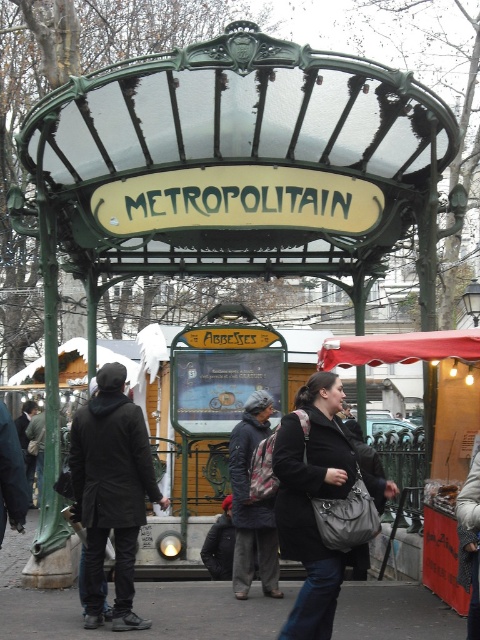
Is matte black coat at center positioned in front of red fabric canopy at center?

Yes.

Between matte black coat at center and red fabric canopy at center, which one has more height?

matte black coat at center

Which is in front, point (327, 560) or point (379, 355)?

Point (327, 560) is in front.

Where is `matte black coat at center`? The height and width of the screenshot is (640, 480). matte black coat at center is located at coordinates (312, 499).